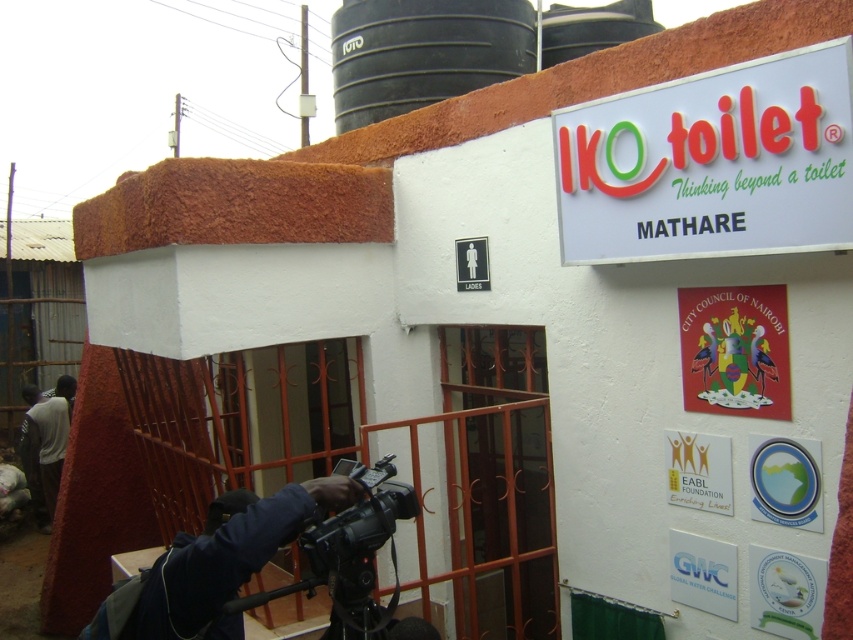
Does point (717, 168) come behind point (38, 436)?

No, (717, 168) is in front of (38, 436).

Can you confirm if white plastic sign at upper right is positioned to the right of dark gray fabric shirt at lower left?

Indeed, white plastic sign at upper right is positioned on the right side of dark gray fabric shirt at lower left.

Which is in front, point (805, 97) or point (32, 492)?

Point (805, 97) is in front.

Find the location of a particular element. Image resolution: width=853 pixels, height=640 pixels. white plastic sign at upper right is located at coordinates click(711, 163).

Is white plastic sign at upper right to the left of black plastic video camera at lower center from the viewer's perspective?

In fact, white plastic sign at upper right is to the right of black plastic video camera at lower center.

Between point (635, 116) and point (312, 524), which one is positioned behind?

The point (635, 116) is more distant.

Is point (807, 241) farther from viewer compared to point (325, 518)?

No, (807, 241) is in front of (325, 518).

This screenshot has width=853, height=640. In order to click on white plastic sign at upper right in this screenshot , I will do `click(711, 163)`.

Does black plastic video camera at lower center have a larger size compared to dark gray fabric shirt at lower left?

No, black plastic video camera at lower center is not bigger than dark gray fabric shirt at lower left.

Is point (370, 532) closer to viewer compared to point (61, 429)?

Yes.

I want to click on black plastic video camera at lower center, so click(x=358, y=528).